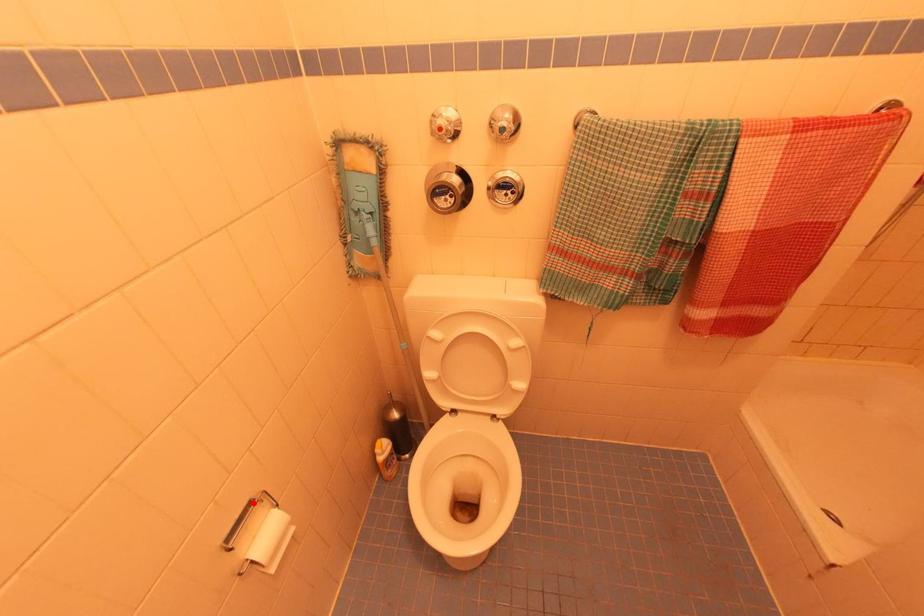
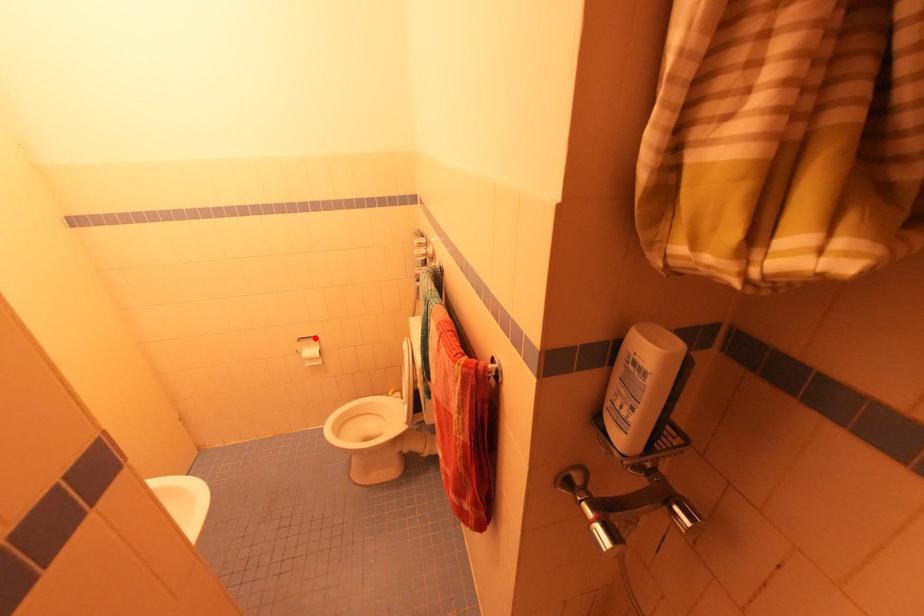
I am providing you with two images of the same scene from different viewpoints. A red point is marked on the first image and another point is marked on the second image. Is the red point in image1 aligned with the point shown in image2?

Yes